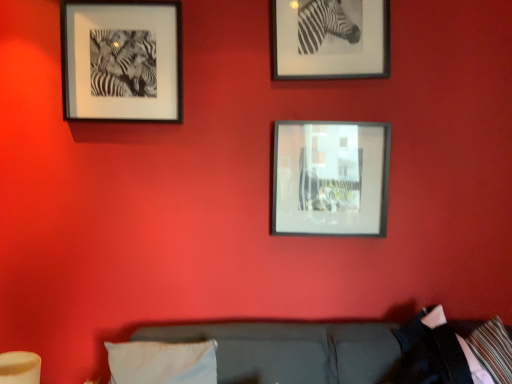
What do you see at coordinates (162, 362) in the screenshot?
I see `white fabric pillow at lower center` at bounding box center [162, 362].

What is the approximate height of black matte picture frame at upper left, acting as the first picture frame starting from the left?

The height of black matte picture frame at upper left, acting as the first picture frame starting from the left, is 21.42 inches.

At what (x,y) coordinates should I click in order to perform the action: click on metallic silver frame at center, arranged as the third picture frame when viewed from the left. Please return your answer as a coordinate pair (x, y). The height and width of the screenshot is (384, 512). Looking at the image, I should click on (330, 178).

Identify the location of metallic silver frame at upper right, marked as the second picture frame in a left-to-right arrangement. (331, 39).

Considering their positions, is metallic silver frame at upper right, the 2th picture frame from the right, located in front of or behind black matte picture frame at upper left, which is the 3th picture frame from right to left?

metallic silver frame at upper right, the 2th picture frame from the right, is behind black matte picture frame at upper left, which is the 3th picture frame from right to left.

Is point (348, 63) more distant than point (101, 2)?

Yes, it is behind point (101, 2).

Locate an element on the screen. picture frame that is above the black matte picture frame at upper left, which is the 3th picture frame from right to left (from the image's perspective) is located at coordinates (331, 39).

Could you tell me if metallic silver frame at upper right, marked as the second picture frame in a left-to-right arrangement, is facing black matte picture frame at upper left, which is the 3th picture frame from right to left?

No, metallic silver frame at upper right, marked as the second picture frame in a left-to-right arrangement, is not facing towards black matte picture frame at upper left, which is the 3th picture frame from right to left.

Does black matte picture frame at upper left, acting as the first picture frame starting from the left, appear on the right side of metallic silver frame at center, arranged as the third picture frame when viewed from the left?

In fact, black matte picture frame at upper left, acting as the first picture frame starting from the left, is to the left of metallic silver frame at center, arranged as the third picture frame when viewed from the left.

Looking at this image, is black matte picture frame at upper left, which is the 3th picture frame from right to left, turned away from metallic silver frame at center, the 1th picture frame positioned from the right?

No, black matte picture frame at upper left, which is the 3th picture frame from right to left,'s orientation is not away from metallic silver frame at center, the 1th picture frame positioned from the right.

Identify the location of the 2nd picture frame behind the black matte picture frame at upper left, acting as the first picture frame starting from the left. (330, 178).

In terms of width, does black matte picture frame at upper left, which is the 3th picture frame from right to left, look wider or thinner when compared to metallic silver frame at center, the 1th picture frame positioned from the right?

black matte picture frame at upper left, which is the 3th picture frame from right to left, is wider than metallic silver frame at center, the 1th picture frame positioned from the right.

Is point (298, 58) behind point (290, 207)?

No, (298, 58) is in front of (290, 207).

Does metallic silver frame at upper right, the 2th picture frame from the right, touch metallic silver frame at center, arranged as the third picture frame when viewed from the left?

metallic silver frame at upper right, the 2th picture frame from the right, is not next to metallic silver frame at center, arranged as the third picture frame when viewed from the left, and they're not touching.

Looking at this image, from a real-world perspective, between metallic silver frame at center, the 1th picture frame positioned from the right, and white fabric pillow at lower center, who is vertically higher?

metallic silver frame at center, the 1th picture frame positioned from the right, from a real-world perspective.

Considering the relative sizes of metallic silver frame at center, the 1th picture frame positioned from the right, and white fabric pillow at lower center in the image provided, is metallic silver frame at center, the 1th picture frame positioned from the right, wider than white fabric pillow at lower center?

No, metallic silver frame at center, the 1th picture frame positioned from the right, is not wider than white fabric pillow at lower center.

Looking at this image, can white fabric pillow at lower center be found inside metallic silver frame at center, the 1th picture frame positioned from the right?

No, white fabric pillow at lower center is located outside of metallic silver frame at center, the 1th picture frame positioned from the right.

Between metallic silver frame at center, the 1th picture frame positioned from the right, and white fabric pillow at lower center, which one is positioned behind?

metallic silver frame at center, the 1th picture frame positioned from the right.

In the scene shown: Does metallic silver frame at center, the 1th picture frame positioned from the right, turn towards metallic silver frame at upper right, the 2th picture frame from the right?

No, metallic silver frame at center, the 1th picture frame positioned from the right, is not oriented towards metallic silver frame at upper right, the 2th picture frame from the right.

Is point (274, 132) positioned before point (292, 70)?

No, (274, 132) is further to viewer.

Would you consider metallic silver frame at center, arranged as the third picture frame when viewed from the left, to be distant from metallic silver frame at upper right, marked as the second picture frame in a left-to-right arrangement?

No, metallic silver frame at center, arranged as the third picture frame when viewed from the left, is not far from metallic silver frame at upper right, marked as the second picture frame in a left-to-right arrangement.

From a real-world perspective, is metallic silver frame at center, arranged as the third picture frame when viewed from the left, positioned above or below metallic silver frame at upper right, the 2th picture frame from the right?

metallic silver frame at center, arranged as the third picture frame when viewed from the left, is below metallic silver frame at upper right, the 2th picture frame from the right.

Which of these two, metallic silver frame at center, the 1th picture frame positioned from the right, or black matte picture frame at upper left, which is the 3th picture frame from right to left, is bigger?

black matte picture frame at upper left, which is the 3th picture frame from right to left, is bigger.

From their relative heights in the image, would you say metallic silver frame at center, the 1th picture frame positioned from the right, is taller or shorter than black matte picture frame at upper left, which is the 3th picture frame from right to left?

In the image, metallic silver frame at center, the 1th picture frame positioned from the right, appears to be shorter than black matte picture frame at upper left, which is the 3th picture frame from right to left.

Considering the relative sizes of metallic silver frame at center, arranged as the third picture frame when viewed from the left, and black matte picture frame at upper left, which is the 3th picture frame from right to left, in the image provided, is metallic silver frame at center, arranged as the third picture frame when viewed from the left, thinner than black matte picture frame at upper left, which is the 3th picture frame from right to left,?

Yes, metallic silver frame at center, arranged as the third picture frame when viewed from the left, is thinner than black matte picture frame at upper left, which is the 3th picture frame from right to left.

From the image's perspective, who appears lower, black matte picture frame at upper left, acting as the first picture frame starting from the left, or metallic silver frame at upper right, the 2th picture frame from the right?

black matte picture frame at upper left, acting as the first picture frame starting from the left.

Can you tell me how much black matte picture frame at upper left, acting as the first picture frame starting from the left, and metallic silver frame at upper right, marked as the second picture frame in a left-to-right arrangement, differ in facing direction?

0.231 degrees.

Does black matte picture frame at upper left, acting as the first picture frame starting from the left, turn towards metallic silver frame at upper right, marked as the second picture frame in a left-to-right arrangement?

No, black matte picture frame at upper left, acting as the first picture frame starting from the left, is not aimed at metallic silver frame at upper right, marked as the second picture frame in a left-to-right arrangement.

Considering the sizes of black matte picture frame at upper left, acting as the first picture frame starting from the left, and metallic silver frame at upper right, the 2th picture frame from the right, in the image, is black matte picture frame at upper left, acting as the first picture frame starting from the left, taller or shorter than metallic silver frame at upper right, the 2th picture frame from the right,?

In the image, black matte picture frame at upper left, acting as the first picture frame starting from the left, appears to be taller than metallic silver frame at upper right, the 2th picture frame from the right.

Find the location of a particular element. picture frame that is above the black matte picture frame at upper left, which is the 3th picture frame from right to left (from a real-world perspective) is located at coordinates (331, 39).

The image size is (512, 384). Identify the location of picture frame beneath the black matte picture frame at upper left, acting as the first picture frame starting from the left (from a real-world perspective). 330,178.

From the image, which object appears to be nearer to black matte picture frame at upper left, which is the 3th picture frame from right to left, white fabric pillow at lower center or metallic silver frame at upper right, marked as the second picture frame in a left-to-right arrangement?

metallic silver frame at upper right, marked as the second picture frame in a left-to-right arrangement.

When comparing their distances from black matte picture frame at upper left, acting as the first picture frame starting from the left, does metallic silver frame at upper right, marked as the second picture frame in a left-to-right arrangement, or white fabric pillow at lower center seem closer?

metallic silver frame at upper right, marked as the second picture frame in a left-to-right arrangement, lies closer to black matte picture frame at upper left, acting as the first picture frame starting from the left, than the other object.

Estimate the real-world distances between objects in this image. Which object is closer to metallic silver frame at upper right, the 2th picture frame from the right, black matte picture frame at upper left, which is the 3th picture frame from right to left, or white fabric pillow at lower center?

black matte picture frame at upper left, which is the 3th picture frame from right to left, is positioned closer to the anchor metallic silver frame at upper right, the 2th picture frame from the right.

Estimate the real-world distances between objects in this image. Which object is closer to black matte picture frame at upper left, which is the 3th picture frame from right to left, white fabric pillow at lower center or metallic silver frame at center, the 1th picture frame positioned from the right?

metallic silver frame at center, the 1th picture frame positioned from the right.

When comparing their distances from metallic silver frame at center, arranged as the third picture frame when viewed from the left, does white fabric pillow at lower center or metallic silver frame at upper right, marked as the second picture frame in a left-to-right arrangement, seem further?

white fabric pillow at lower center.

Looking at the image, which one is located further to metallic silver frame at upper right, the 2th picture frame from the right, white fabric pillow at lower center or black matte picture frame at upper left, which is the 3th picture frame from right to left?

Based on the image, white fabric pillow at lower center appears to be further to metallic silver frame at upper right, the 2th picture frame from the right.

Based on their spatial positions, is metallic silver frame at center, the 1th picture frame positioned from the right, or metallic silver frame at upper right, marked as the second picture frame in a left-to-right arrangement, closer to black matte picture frame at upper left, which is the 3th picture frame from right to left?

metallic silver frame at upper right, marked as the second picture frame in a left-to-right arrangement, is closer to black matte picture frame at upper left, which is the 3th picture frame from right to left.

Looking at the image, which one is located further to white fabric pillow at lower center, metallic silver frame at center, the 1th picture frame positioned from the right, or black matte picture frame at upper left, acting as the first picture frame starting from the left?

black matte picture frame at upper left, acting as the first picture frame starting from the left.

You are a GUI agent. You are given a task and a screenshot of the screen. Output one action in this format:
    pyautogui.click(x=<x>, y=<y>)
    Task: Click on the picture frame between black matte picture frame at upper left, acting as the first picture frame starting from the left, and metallic silver frame at center, the 1th picture frame positioned from the right, in the horizontal direction
    
    Given the screenshot: What is the action you would take?
    pyautogui.click(x=331, y=39)

Image resolution: width=512 pixels, height=384 pixels. In order to click on picture frame that lies between black matte picture frame at upper left, which is the 3th picture frame from right to left, and white fabric pillow at lower center from top to bottom in this screenshot , I will do `click(330, 178)`.